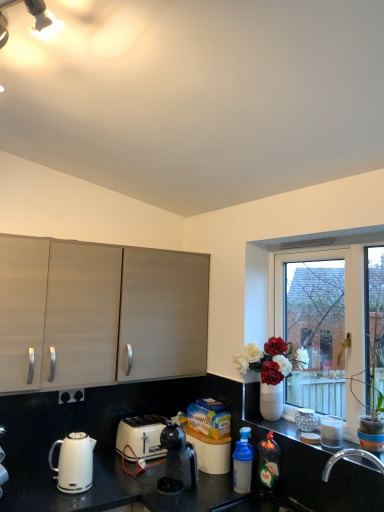
Identify the location of free space above translucent glass vase at lower right (from a real-world perspective). (293, 434).